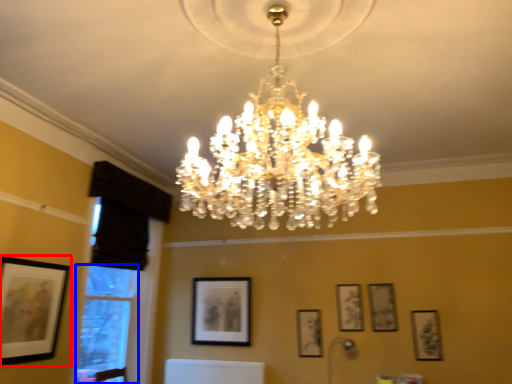
Question: Which object is closer to the camera taking this photo, picture frame (highlighted by a red box) or window (highlighted by a blue box)?

Choices:
 (A) picture frame
 (B) window

Answer: (A)